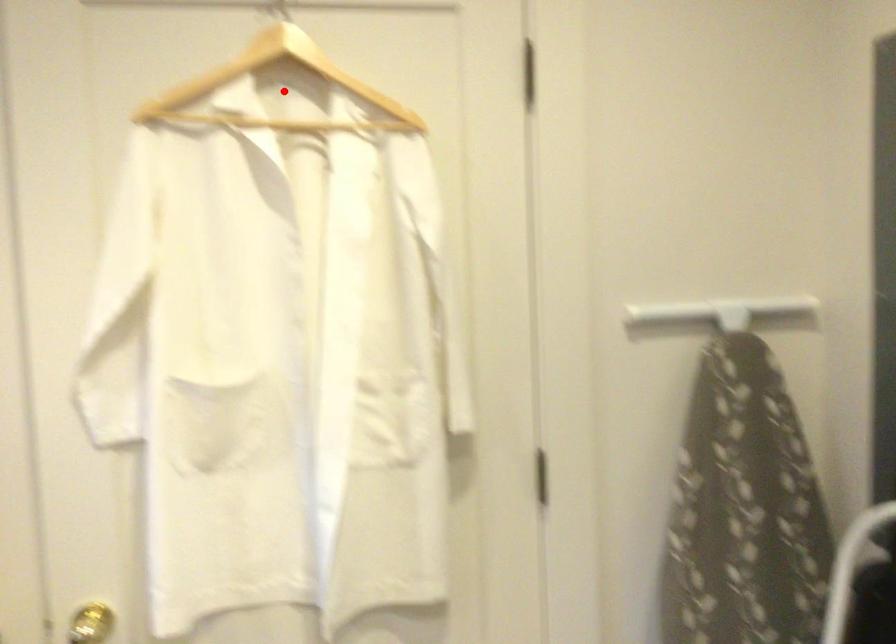
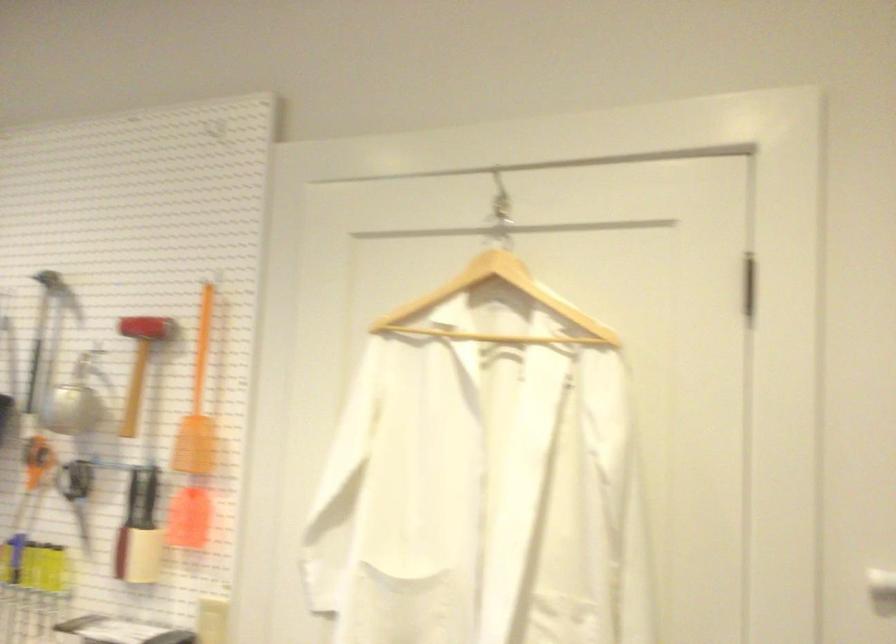
Where in the second image is the point corresponding to the highlighted location from the first image?

(496, 307)